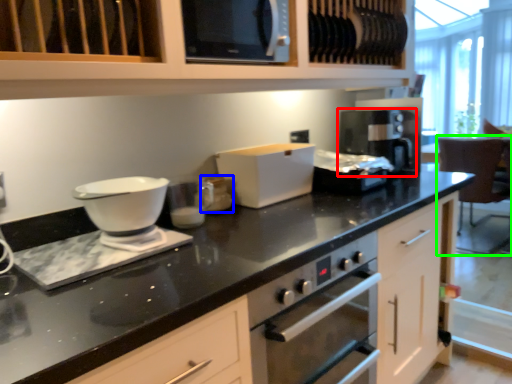
Question: Based on their relative distances, which object is farther from coffee machine (highlighted by a red box)? Choose from appliance (highlighted by a blue box) and chair (highlighted by a green box).

Choices:
 (A) appliance
 (B) chair

Answer: (B)